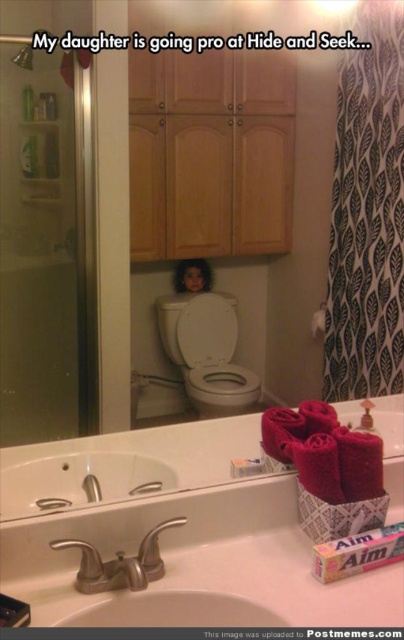
You are a plumber inspecting a bathroom and need to access the pipes under the brushed metal faucet at lower left. The white glossy toilet bowl at center is in the way. Can you move the toilet bowl to reach the faucet? Explain why or why not based on their positions.

The white glossy toilet bowl at center is further to the viewer than the brushed metal faucet at lower left. This means the toilet bowl is closer to you, blocking access to the faucet behind it. Since the toilet bowl is positioned in front of the faucet, you would need to move the toilet bowl to access the pipes under the faucet.

You are a home inspector evaluating bathroom fixtures. You notice the white ceramic sink at lower center and the smooth skin doll at center. Which object is shorter in height?

The white ceramic sink at lower center is shorter than the smooth skin doll at center.